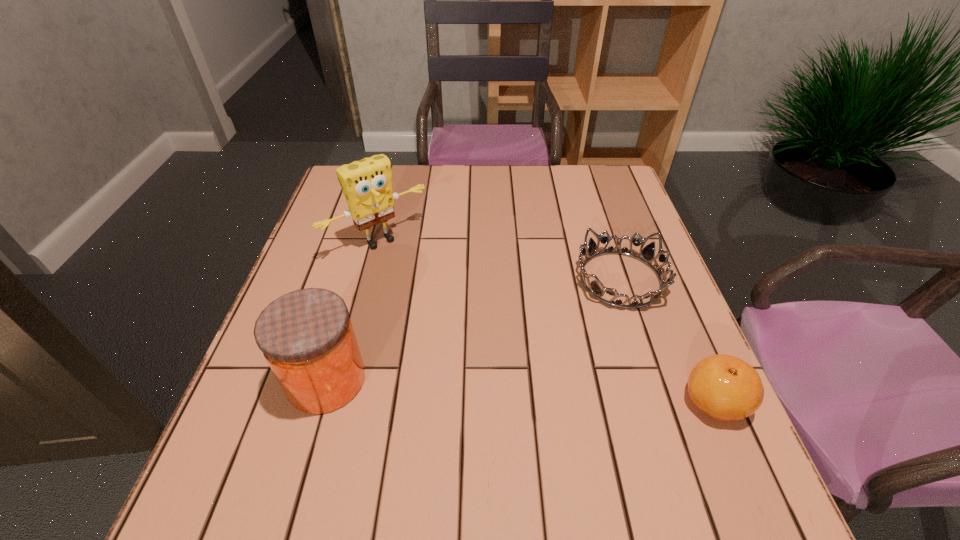
At what (x,y) coordinates should I click in order to perform the action: click on free space on the desktop that is between the third shortest object and the clementine and is positioned on the front-facing side of the tiara. Please return your answer as a coordinate pair (x, y). The height and width of the screenshot is (540, 960). Looking at the image, I should click on (462, 387).

Where is `free space on the desktop that is between the second tallest object and the clementine and is positioned on the face of the sponge`? The height and width of the screenshot is (540, 960). free space on the desktop that is between the second tallest object and the clementine and is positioned on the face of the sponge is located at coordinates (512, 390).